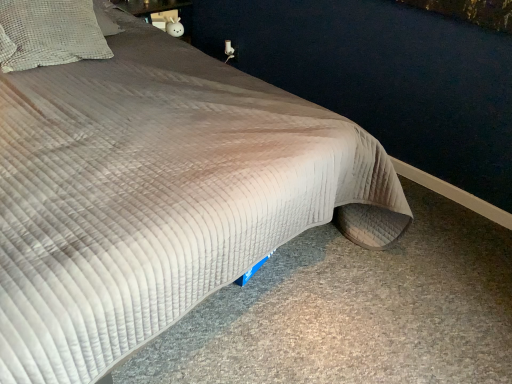
Describe the element at coordinates (51, 33) in the screenshot. This screenshot has height=384, width=512. I see `beige checkered pillow at upper left` at that location.

The image size is (512, 384). What are the coordinates of `beige checkered pillow at upper left` in the screenshot? It's located at click(51, 33).

In order to face beige checkered pillow at upper left, should I rotate leftwards or rightwards?

To align with it, rotate left about 25.738°.

You are a GUI agent. You are given a task and a screenshot of the screen. Output one action in this format:
    pyautogui.click(x=<x>, y=<y>)
    Task: Click on the beige checkered pillow at upper left
    The height and width of the screenshot is (384, 512).
    Given the screenshot: What is the action you would take?
    pyautogui.click(x=51, y=33)